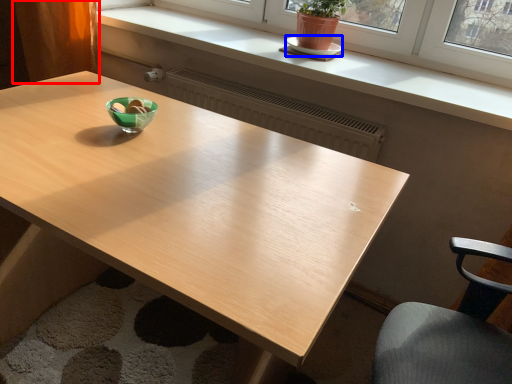
Question: Among these objects, which one is farthest to the camera, curtain (highlighted by a red box) or saucer (highlighted by a blue box)?

Choices:
 (A) curtain
 (B) saucer

Answer: (A)